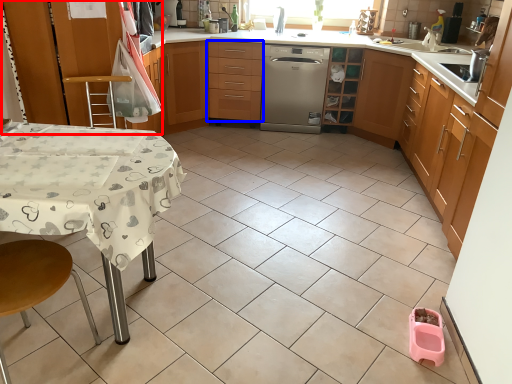
Question: Which point is closer to the camera, cabinetry (highlighted by a red box) or drawer (highlighted by a blue box)?

Choices:
 (A) cabinetry
 (B) drawer

Answer: (A)